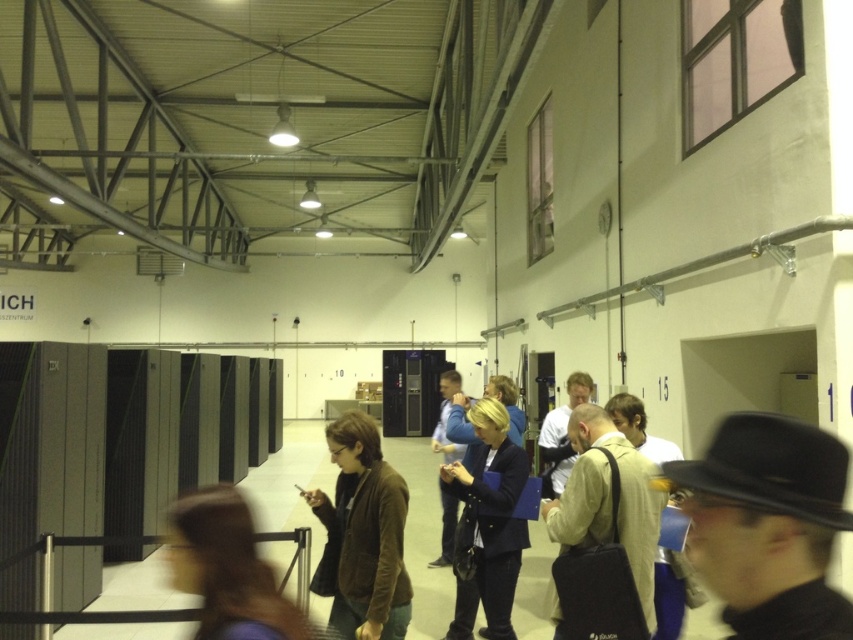
You are a security guard in this data center and notice two jackets hanging on a rack. The jackets are the brown suede jacket at center and the light brown leather jacket at center. Which jacket is positioned lower on the rack?

The brown suede jacket at center is positioned lower on the rack since it is below the light brown leather jacket at center.

Consider the image. You are standing in the data center and need to reach a specific point. You have two points to choose from, point (x=370, y=513) and point (x=546, y=445). Which point is closer to you?

Point (x=370, y=513) is closer to the viewer than point (x=546, y=445).

You are a security guard in the data center. You notice two jackets hanging on a rack in the middle of the room. Which jacket is closer to you, the brown suede jacket at center or the brown leather jacket at center?

The brown suede jacket at center is closer to you because the brown leather jacket at center is behind it.